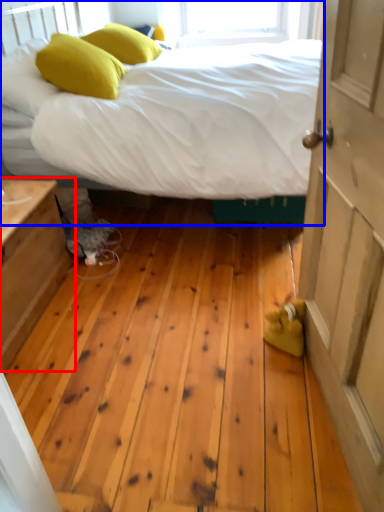
Question: Which point is closer to the camera, nightstand (highlighted by a red box) or bed (highlighted by a blue box)?

Choices:
 (A) nightstand
 (B) bed

Answer: (A)